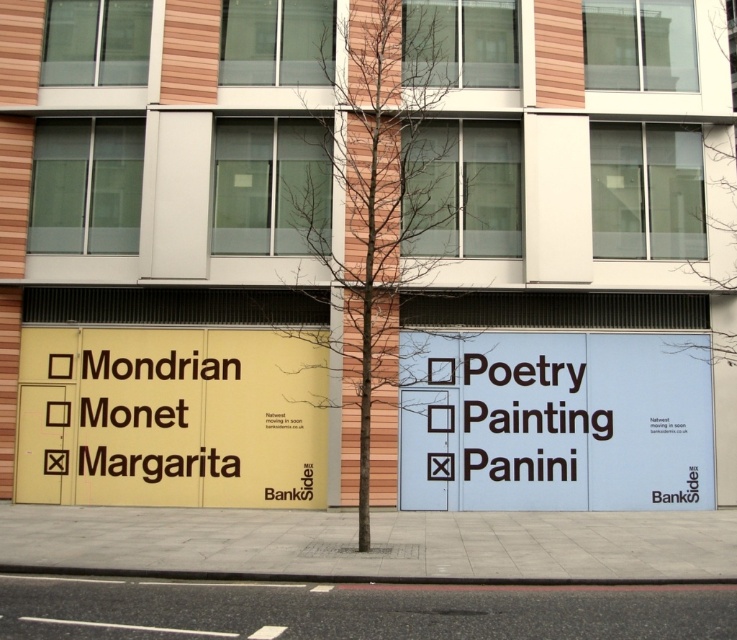
Question: Does white paper sign at center appear on the right side of yellow matte signboard at left?

Choices:
 (A) yes
 (B) no

Answer: (A)

Question: Which point is farther to the camera?

Choices:
 (A) white paper sign at center
 (B) yellow matte signboard at left

Answer: (B)

Question: Is white paper sign at center above yellow matte signboard at left?

Choices:
 (A) no
 (B) yes

Answer: (A)

Question: Which point is closer to the camera?

Choices:
 (A) yellow matte signboard at left
 (B) white paper sign at center

Answer: (B)

Question: Which object is farther from the camera taking this photo?

Choices:
 (A) yellow matte signboard at left
 (B) white paper sign at center

Answer: (A)

Question: Is white paper sign at center thinner than yellow matte signboard at left?

Choices:
 (A) yes
 (B) no

Answer: (B)